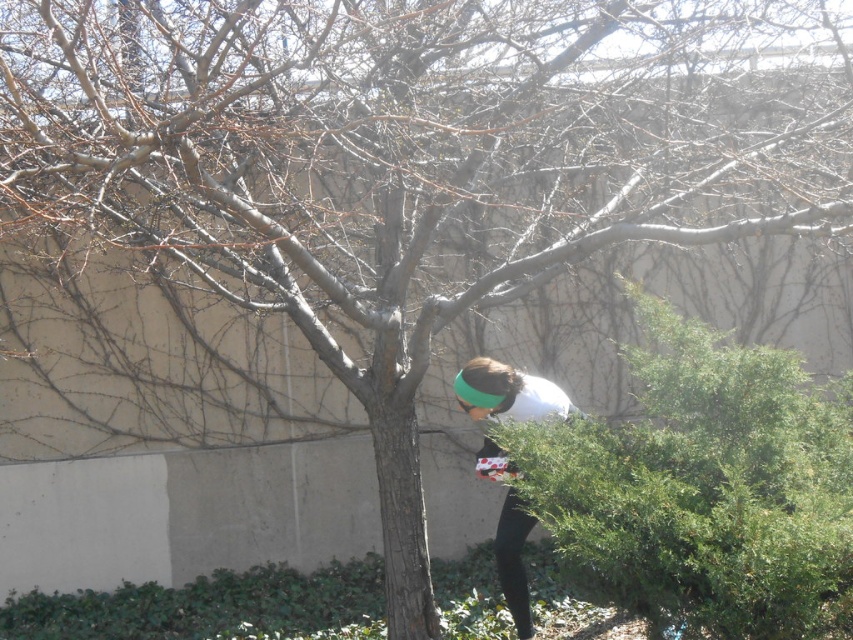
Looking at this image, you are a gardener who wants to plant a new shrub that requires at least 2 meters of space. You see the green leafy hedge at lower right and the white fabric at center. Which object has enough vertical space for the shrub?

The white fabric at center has greater height than the green leafy hedge at lower right, so the white fabric at center provides enough vertical space for the shrub that requires at least 2 meters.

In the scene shown: You are standing at the center of the image and want to move towards the green leafy hedge at lower right. Based on its position coordinates, which direction should you move in?

The green leafy hedge at lower right is located at coordinates point (704, 486), so you should move towards the lower right direction to reach it.

You are a fashion designer observing the outdoor scene. You notice the white fabric at center and the black matte leggings at lower center. Which item is positioned higher in the image?

The white fabric at center is located above the black matte leggings at lower center, so it is positioned higher in the image.